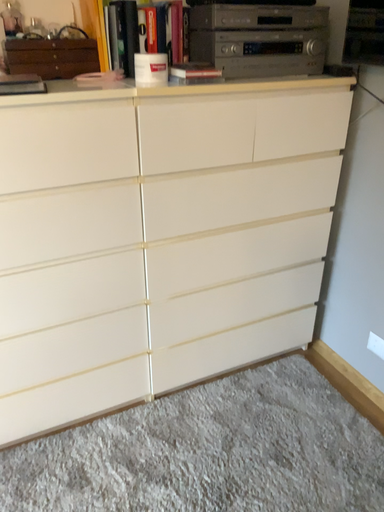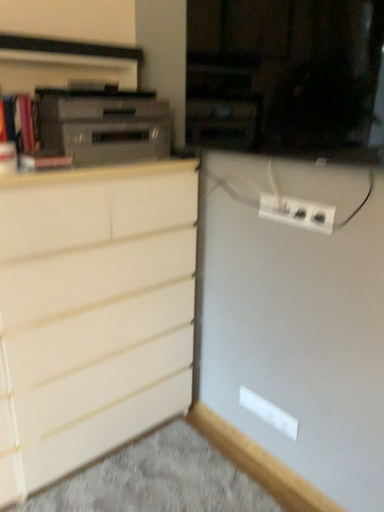
Question: How did the camera likely rotate when shooting the video?

Choices:
 (A) rotated upward
 (B) rotated downward

Answer: (A)